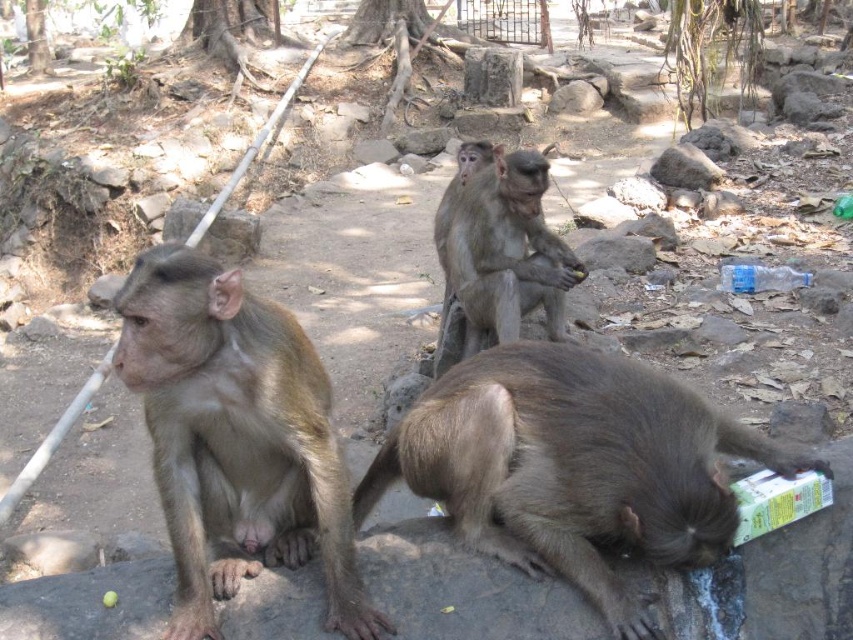
Can you confirm if fuzzy brown monkey at left is thinner than gray furry monkey at center?

Correct, fuzzy brown monkey at left's width is less than gray furry monkey at center's.

Is fuzzy brown monkey at left bigger than gray furry monkey at center?

Incorrect, fuzzy brown monkey at left is not larger than gray furry monkey at center.

Which is behind, point (177, 262) or point (463, 339)?

The point (463, 339) is more distant.

The width and height of the screenshot is (853, 640). Find the location of `fuzzy brown monkey at left`. fuzzy brown monkey at left is located at coordinates (235, 436).

Is brown furry monkey at lower right below fuzzy brown monkey at left?

Correct, brown furry monkey at lower right is located below fuzzy brown monkey at left.

Describe the element at coordinates (573, 467) in the screenshot. The width and height of the screenshot is (853, 640). I see `brown furry monkey at lower right` at that location.

Is point (448, 420) less distant than point (190, 508)?

No, it is not.

The width and height of the screenshot is (853, 640). I want to click on brown furry monkey at lower right, so click(573, 467).

Who is higher up, brown furry monkey at lower right or gray furry monkey at center?

gray furry monkey at center

Is brown furry monkey at lower right bigger than gray furry monkey at center?

Incorrect, brown furry monkey at lower right is not larger than gray furry monkey at center.

What are the coordinates of `brown furry monkey at lower right` in the screenshot? It's located at (573, 467).